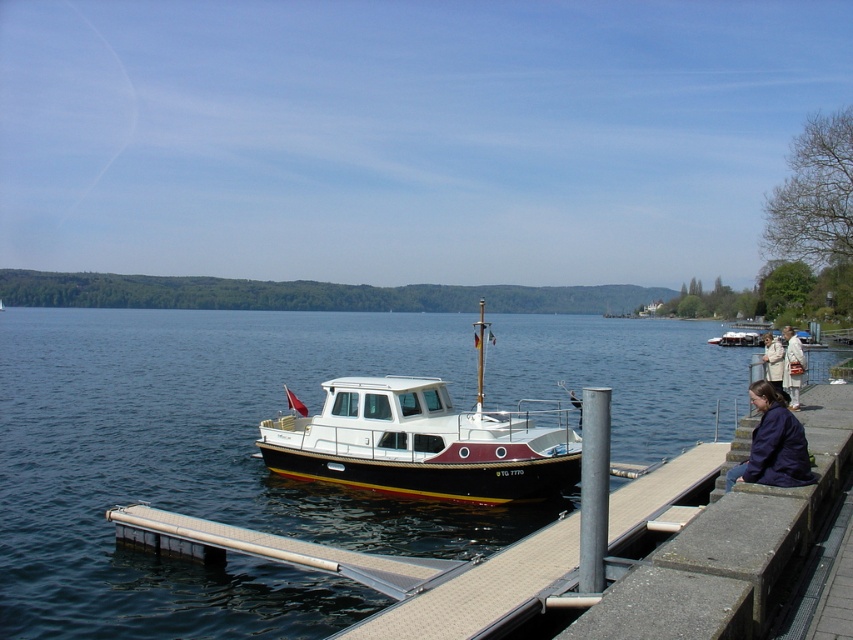
Question: Which point is farther to the camera?

Choices:
 (A) blue water at center
 (B) dark blue jacket at lower right
 (C) white glossy cabin cruiser at center
 (D) white fabric coat at right

Answer: (C)

Question: Does white glossy cabin cruiser at center have a lesser width compared to white wool coat at lower right?

Choices:
 (A) yes
 (B) no

Answer: (A)

Question: Estimate the real-world distances between objects in this image. Which object is farther from the dark blue jacket at lower right?

Choices:
 (A) white fabric coat at right
 (B) white glossy cabin cruiser at center
 (C) white wool coat at lower right
 (D) blue water at center

Answer: (D)

Question: Can you confirm if blue water at center is positioned below white fabric coat at right?

Choices:
 (A) no
 (B) yes

Answer: (A)

Question: Is white glossy cabin cruiser at center above white wool coat at lower right?

Choices:
 (A) no
 (B) yes

Answer: (A)

Question: Based on their relative distances, which object is nearer to the white fabric coat at right?

Choices:
 (A) blue water at center
 (B) white wool coat at lower right
 (C) dark blue jacket at lower right
 (D) white glossy cabin cruiser at center

Answer: (C)